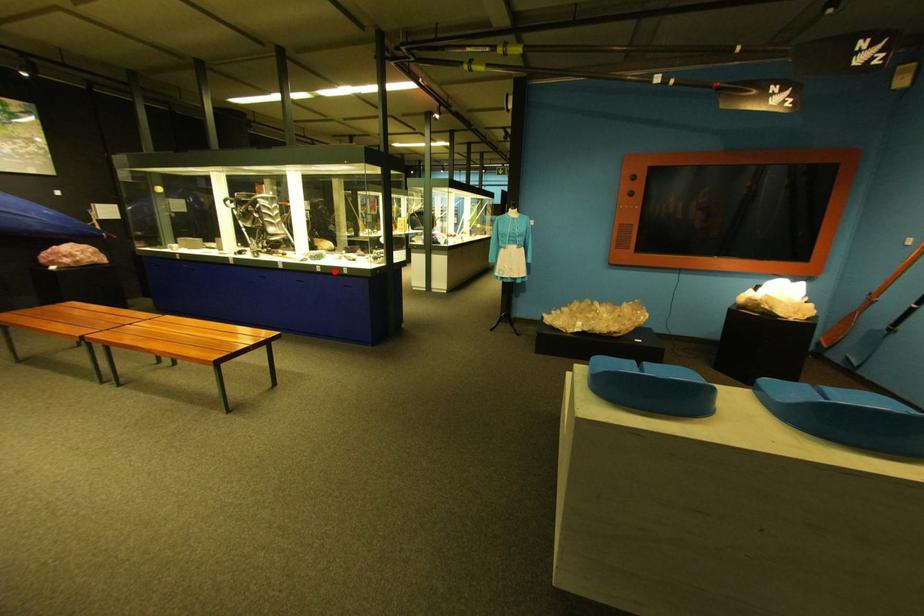
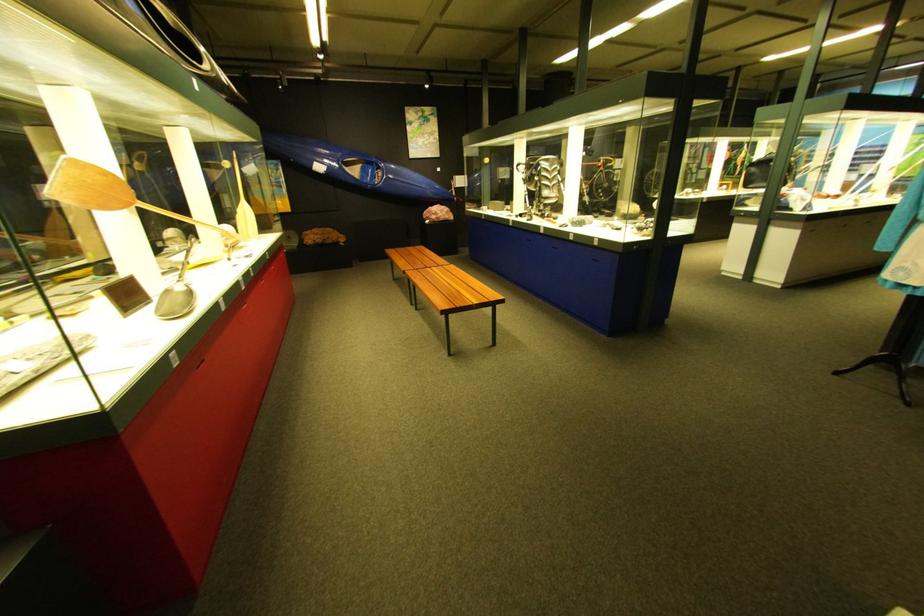
The point at the highlighted location is marked in the first image. Where is the corresponding point in the second image?

(588, 240)